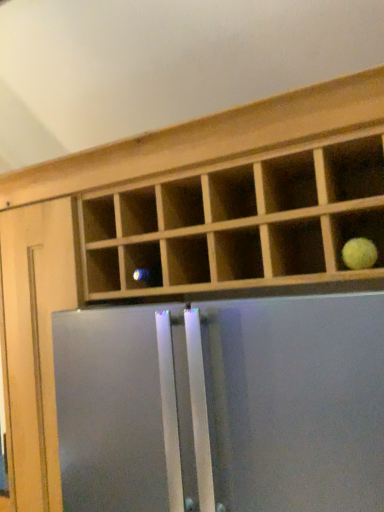
Question: From a real-world perspective, is yellow matte tennis ball at upper right positioned above or below satin silver refrigerator at center?

Choices:
 (A) below
 (B) above

Answer: (B)

Question: In terms of height, does yellow matte tennis ball at upper right look taller or shorter compared to satin silver refrigerator at center?

Choices:
 (A) tall
 (B) short

Answer: (B)

Question: Considering the positions of yellow matte tennis ball at upper right and satin silver refrigerator at center in the image, is yellow matte tennis ball at upper right wider or thinner than satin silver refrigerator at center?

Choices:
 (A) wide
 (B) thin

Answer: (B)

Question: Is satin silver refrigerator at center in front of or behind yellow matte tennis ball at upper right in the image?

Choices:
 (A) front
 (B) behind

Answer: (A)

Question: Based on their positions, is satin silver refrigerator at center located to the left or right of yellow matte tennis ball at upper right?

Choices:
 (A) left
 (B) right

Answer: (A)

Question: From the image's perspective, is satin silver refrigerator at center located above or below yellow matte tennis ball at upper right?

Choices:
 (A) below
 (B) above

Answer: (A)

Question: Is point (180, 450) closer or farther from the camera than point (349, 249)?

Choices:
 (A) farther
 (B) closer

Answer: (B)